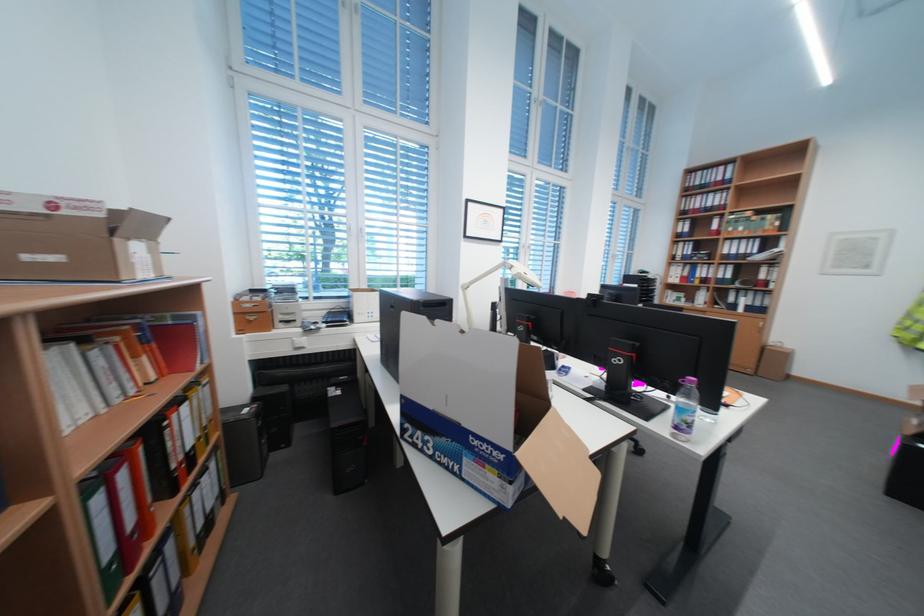
This screenshot has height=616, width=924. Describe the element at coordinates (524, 274) in the screenshot. I see `a white lamp head` at that location.